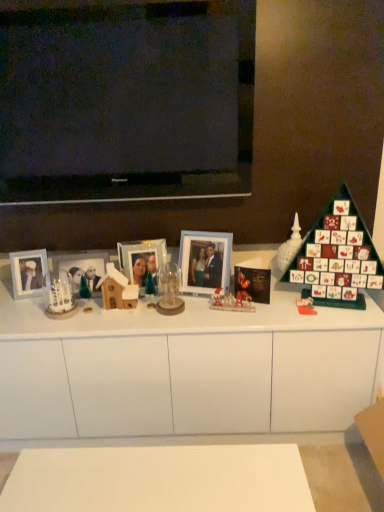
At what (x,y) coordinates should I click in order to perform the action: click on free space to the left of green matte advent calendar at right. Please return your answer as a coordinate pair (x, y). This screenshot has width=384, height=512. Looking at the image, I should click on (269, 312).